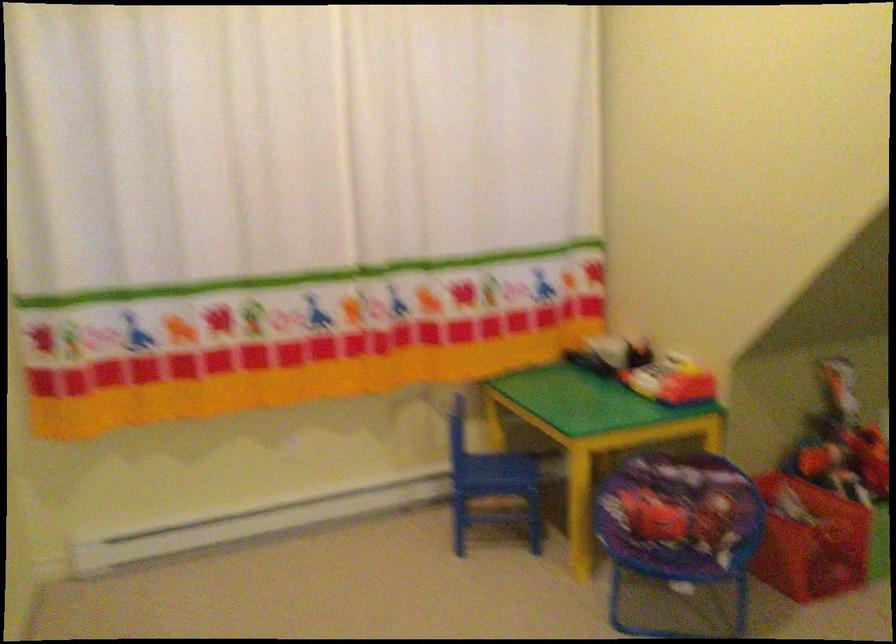
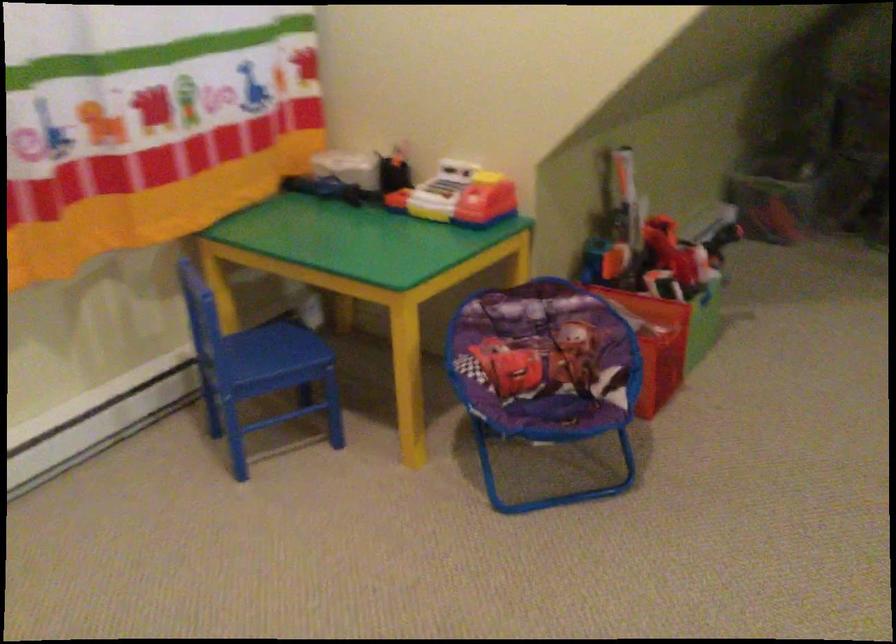
Question: Based on the continuous images, in which direction is the camera rotating? Reply with the corresponding letter.

Choices:
 (A) Left
 (B) Right
 (C) Up
 (D) Down

Answer: (B)